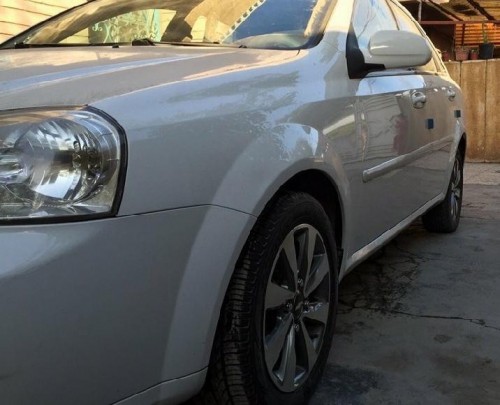
At what (x,y) coordinates should I click in order to perform the action: click on door handles. Please return your answer as a coordinate pair (x, y). The height and width of the screenshot is (405, 500). Looking at the image, I should click on (414, 99), (450, 89).